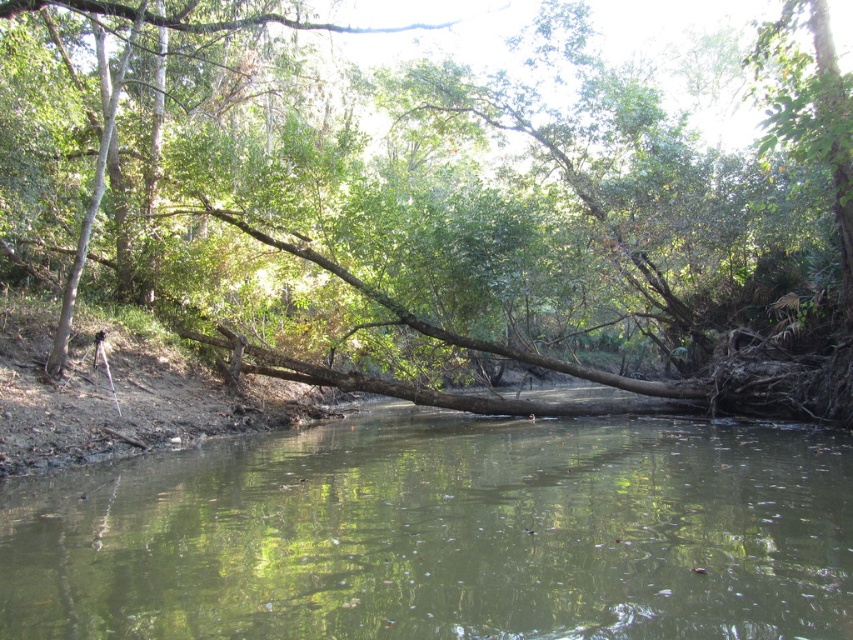
Looking at this image, you are a kayaker preparing to cross the green muddy river at center. There is a brown rough log at center in the way. Can you safely navigate around the log? Please state the distance between them to justify your answer.

The brown rough log at center and green muddy river at center are 11.36 meters apart. Since the distance is sufficient, you can safely navigate around the log by maintaining a safe distance of 11.36 meters between the log and the river.

You are a hiker who wants to cross the green muddy river at center. There is a brown rough log at center nearby. Can you use the log to cross the river safely?

The brown rough log at center has a larger size compared to green muddy river at center, so yes, the log is wide enough to safely cross the green muddy river at center.